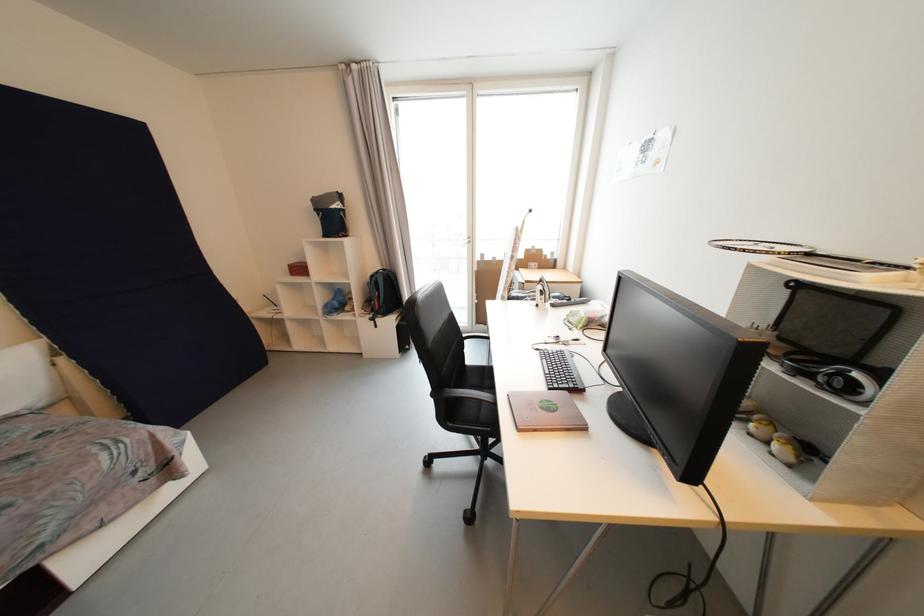
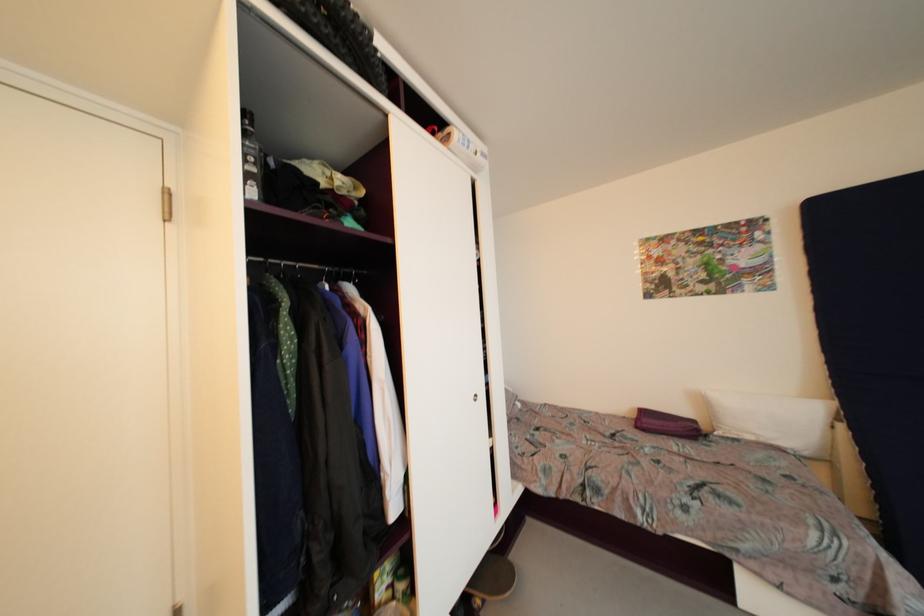
Where in the second image is the point corresponding to the point at 46,407 from the first image?

(810, 456)